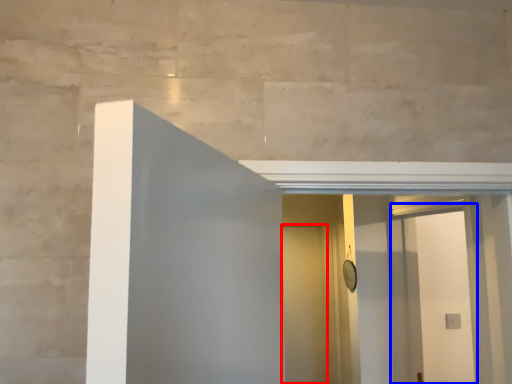
Question: Which of the following is the farthest to the observer, door (highlighted by a red box) or screen door (highlighted by a blue box)?

Choices:
 (A) door
 (B) screen door

Answer: (A)